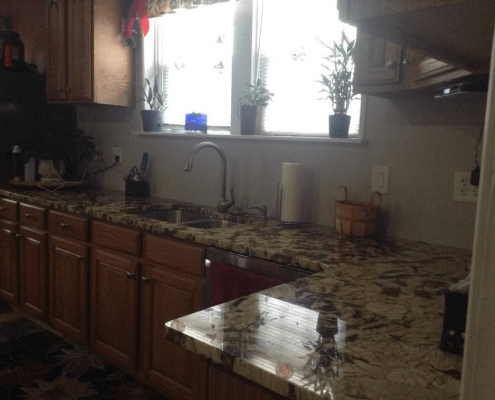
Locate an element on the screen. This screenshot has height=400, width=495. kitchen cabinet door is located at coordinates (75, 66), (56, 66), (28, 277), (58, 288), (109, 291), (156, 305), (9, 262), (365, 65), (424, 67).